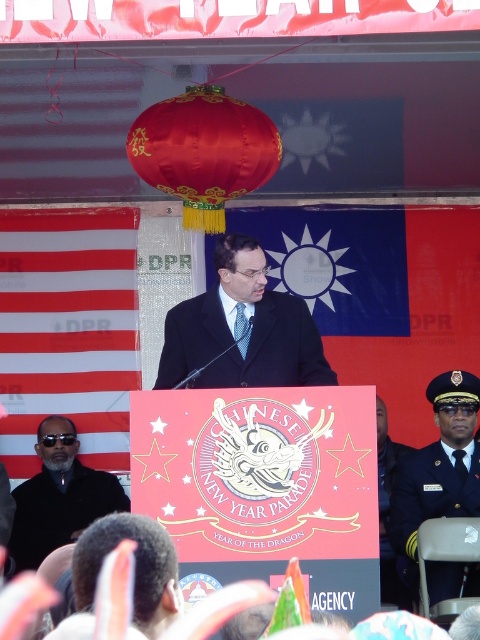
Question: Can you confirm if matte black suit at center is positioned to the right of shiny silk paper lantern at upper center?

Choices:
 (A) yes
 (B) no

Answer: (A)

Question: Among these objects, which one is farthest from the camera?

Choices:
 (A) dark blue uniform at right
 (B) black uniform at center
 (C) red/white striped flag at left
 (D) black matte coat at left

Answer: (C)

Question: Which is nearer to the shiny silk paper lantern at upper center?

Choices:
 (A) matte black suit at center
 (B) dark blue uniform at right
 (C) black matte coat at left

Answer: (A)

Question: Is black uniform at center bigger than dark blue uniform at right?

Choices:
 (A) yes
 (B) no

Answer: (A)

Question: Which point appears farthest from the camera in this image?

Choices:
 (A) (376, 444)
 (B) (83, 289)
 (C) (469, 465)
 (D) (252, 308)

Answer: (B)

Question: Is black matte coat at left positioned before dark blue uniform at right?

Choices:
 (A) yes
 (B) no

Answer: (B)